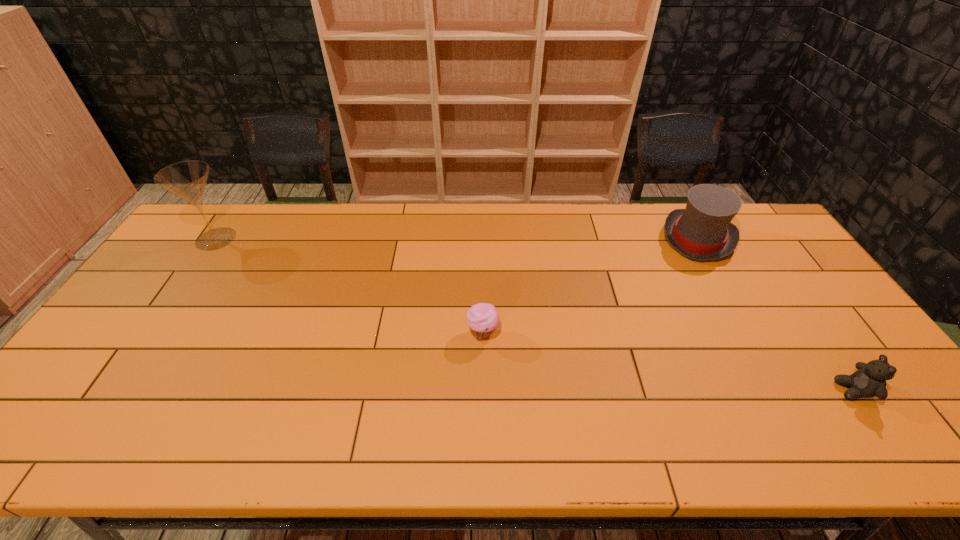
I want to click on vacant area that lies between the second tallest object and the second shortest object, so click(x=776, y=314).

Locate an element on the screen. unoccupied position between the second tallest object and the teddy bear is located at coordinates (776, 314).

At what (x,y) coordinates should I click in order to perform the action: click on vacant space in between the teddy bear and the tallest object. Please return your answer as a coordinate pair (x, y). Looking at the image, I should click on (535, 314).

Find the location of `unoccupied position between the shortest object and the second tallest object`. unoccupied position between the shortest object and the second tallest object is located at coordinates (590, 286).

The image size is (960, 540). I want to click on free space between the second tallest object and the cupcake, so click(590, 286).

You are a GUI agent. You are given a task and a screenshot of the screen. Output one action in this format:
    pyautogui.click(x=<x>, y=<y>)
    Task: Click on the empty location between the leftmost object and the teddy bear
    Image resolution: width=960 pixels, height=540 pixels.
    Given the screenshot: What is the action you would take?
    [x=535, y=314]

Select which object appears as the second closest to the cupcake. Please provide its 2D coordinates. Your answer should be formatted as a tuple, i.e. [(x, y)], where the tuple contains the x and y coordinates of a point satisfying the conditions above.

[(869, 380)]

Select which object is the third closest to the leftmost object. Please provide its 2D coordinates. Your answer should be formatted as a tuple, i.e. [(x, y)], where the tuple contains the x and y coordinates of a point satisfying the conditions above.

[(869, 380)]

Find the location of a particular element. This screenshot has width=960, height=540. vacant space that satisfies the following two spatial constraints: 1. on the front side of the tallest object; 2. on the left side of the cupcake is located at coordinates (152, 333).